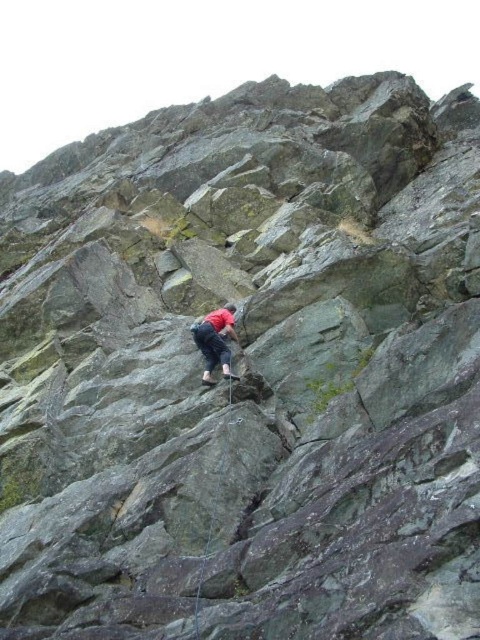
Question: Which of the following is the closest to the observer?

Choices:
 (A) red fabric shirt at center
 (B) black nylon rope at center

Answer: (B)

Question: Can you confirm if red fabric shirt at center is positioned below black nylon rope at center?

Choices:
 (A) no
 (B) yes

Answer: (A)

Question: Is red fabric shirt at center thinner than black nylon rope at center?

Choices:
 (A) no
 (B) yes

Answer: (A)

Question: Can you confirm if red fabric shirt at center is positioned below black nylon rope at center?

Choices:
 (A) yes
 (B) no

Answer: (B)

Question: Which object is closer to the camera taking this photo?

Choices:
 (A) red fabric shirt at center
 (B) black nylon rope at center

Answer: (B)

Question: Which of the following is the closest to the observer?

Choices:
 (A) red fabric shirt at center
 (B) black nylon rope at center

Answer: (B)